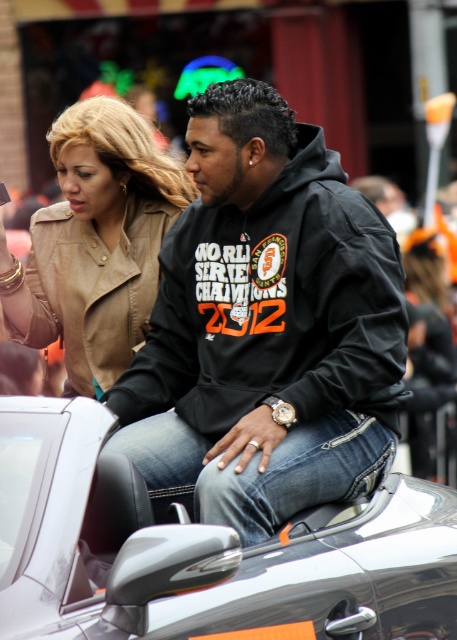
Question: Which object appears farthest from the camera in this image?

Choices:
 (A) shiny silver convertible at center
 (B) black hoodie at center
 (C) leather jacket at center

Answer: (C)

Question: Can you confirm if black hoodie at center is positioned below leather jacket at center?

Choices:
 (A) yes
 (B) no

Answer: (B)

Question: Considering the real-world distances, which object is closest to the leather jacket at center?

Choices:
 (A) shiny silver convertible at center
 (B) black hoodie at center

Answer: (B)

Question: Which point appears closest to the camera in this image?

Choices:
 (A) (319, 276)
 (B) (117, 276)
 (C) (95, 634)

Answer: (C)

Question: Does black hoodie at center appear under shiny silver convertible at center?

Choices:
 (A) yes
 (B) no

Answer: (B)

Question: Considering the relative positions of black hoodie at center and shiny silver convertible at center in the image provided, where is black hoodie at center located with respect to shiny silver convertible at center?

Choices:
 (A) above
 (B) below

Answer: (A)